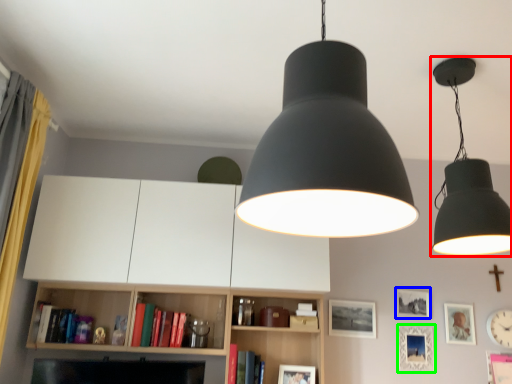
Question: Which object is positioned farthest from lamp (highlighted by a red box)? Select from picture frame (highlighted by a blue box) and picture frame (highlighted by a green box).

Choices:
 (A) picture frame
 (B) picture frame

Answer: (B)